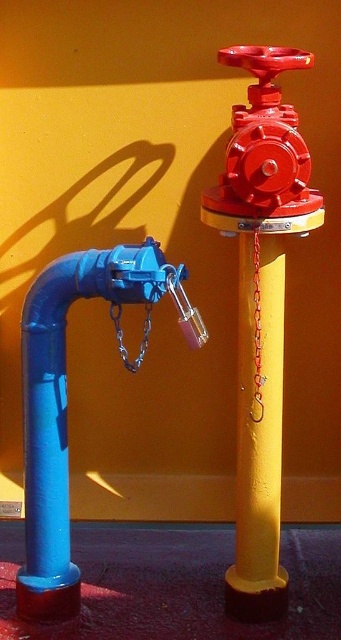
Which is behind, point (55, 320) or point (242, 413)?

Positioned behind is point (242, 413).

Who is more distant from viewer, (45, 310) or (277, 528)?

The point (277, 528) is more distant.

You are a GUI agent. You are given a task and a screenshot of the screen. Output one action in this format:
    pyautogui.click(x=<x>, y=<y>)
    Task: Click on the blue matte water pipe at left
    The image size is (341, 640).
    Given the screenshot: What is the action you would take?
    pyautogui.click(x=66, y=400)

Who is shorter, yellow matte/yellowish-golden pole at center-right or shiny red valve at upper right?

shiny red valve at upper right is shorter.

Is yellow matte/yellowish-golden pole at center-right in front of shiny red valve at upper right?

No.

Is point (251, 381) positioned behind point (253, 216)?

Yes, point (251, 381) is behind point (253, 216).

Where is `yellow matte/yellowish-golden pole at center-right`? The width and height of the screenshot is (341, 640). yellow matte/yellowish-golden pole at center-right is located at coordinates (259, 436).

What do you see at coordinates (66, 400) in the screenshot? I see `blue matte water pipe at left` at bounding box center [66, 400].

From the picture: Is blue matte water pipe at left wider than shiny red valve at upper right?

Indeed, blue matte water pipe at left has a greater width compared to shiny red valve at upper right.

Which is in front, point (34, 614) or point (271, 58)?

Point (271, 58)

Where is `blue matte water pipe at left`? blue matte water pipe at left is located at coordinates (66, 400).